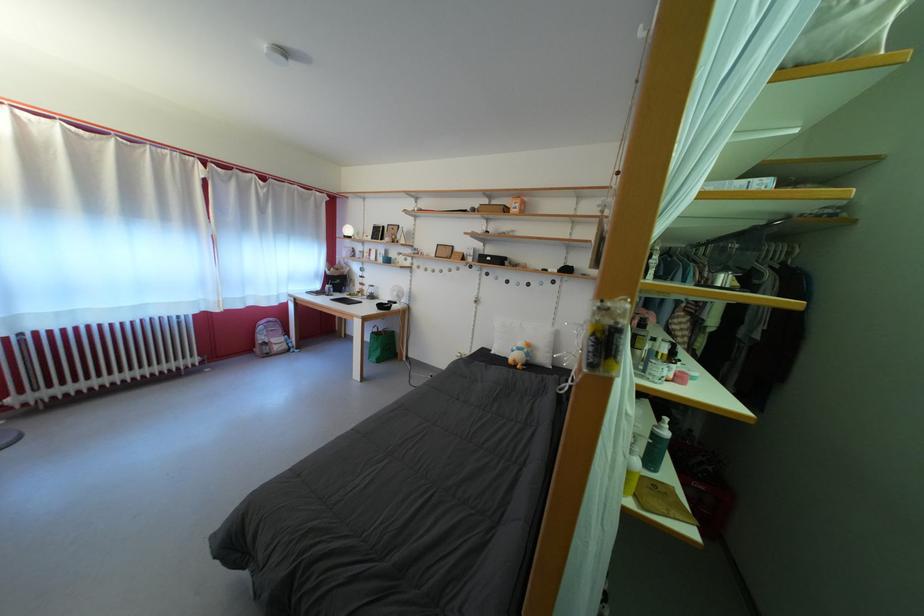
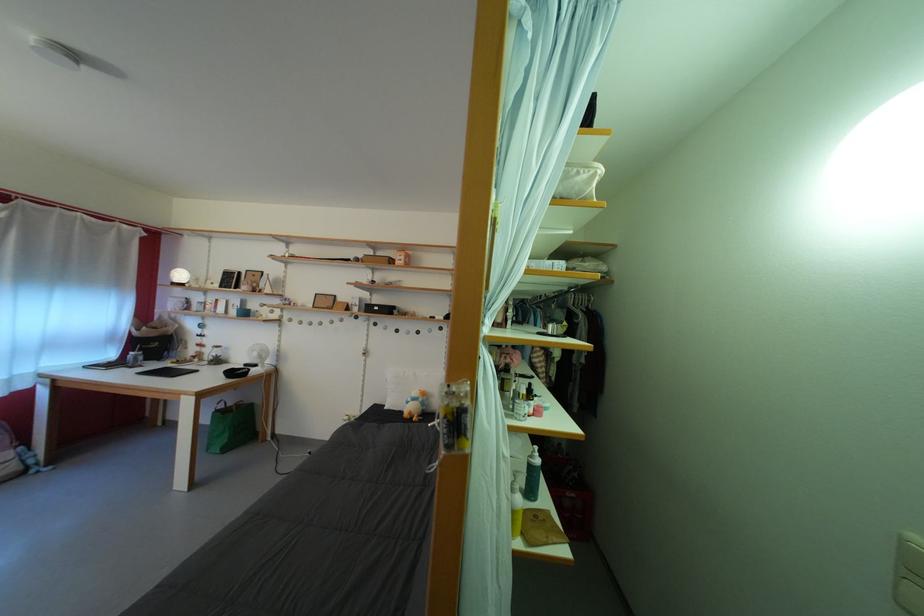
Question: Based on the continuous images, in which direction is the camera rotating? Reply with the corresponding letter.

Choices:
 (A) Left
 (B) Right
 (C) Up
 (D) Down

Answer: (B)